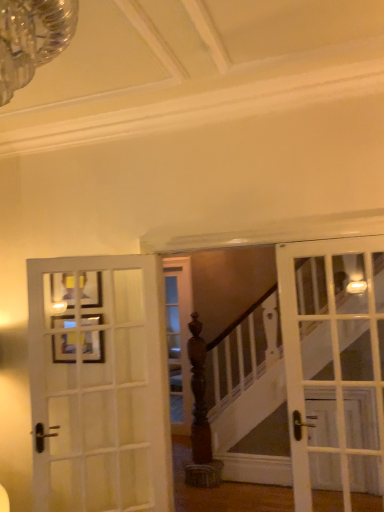
The image size is (384, 512). What do you see at coordinates (334, 359) in the screenshot?
I see `white glass door at right, marked as the first door in a right-to-left arrangement` at bounding box center [334, 359].

Describe the element at coordinates (99, 384) in the screenshot. The height and width of the screenshot is (512, 384). I see `white wood door at left, arranged as the 2th door when viewed from the right` at that location.

What do you see at coordinates (92, 346) in the screenshot? The width and height of the screenshot is (384, 512). I see `wooden picture frame at upper left` at bounding box center [92, 346].

This screenshot has height=512, width=384. I want to click on white glass door at right, marked as the first door in a right-to-left arrangement, so click(x=334, y=359).

Considering the sizes of objects white glass door at right, marked as the first door in a right-to-left arrangement, and white wood door at left, arranged as the 2th door when viewed from the right, in the image provided, who is wider, white glass door at right, marked as the first door in a right-to-left arrangement, or white wood door at left, arranged as the 2th door when viewed from the right,?

white glass door at right, marked as the first door in a right-to-left arrangement.

Is white glass door at right, the 2th door when ordered from left to right, bigger or smaller than white wood door at left, arranged as the 1th door when viewed from the left?

In the image, white glass door at right, the 2th door when ordered from left to right, appears to be smaller than white wood door at left, arranged as the 1th door when viewed from the left.

Are white glass door at right, the 2th door when ordered from left to right, and white wood door at left, arranged as the 1th door when viewed from the left, beside each other?

white glass door at right, the 2th door when ordered from left to right, and white wood door at left, arranged as the 1th door when viewed from the left, are clearly separated.

Where is `door in front of the white wood door at left, arranged as the 2th door when viewed from the right`? door in front of the white wood door at left, arranged as the 2th door when viewed from the right is located at coordinates (334, 359).

Visually, is white wood door at left, arranged as the 1th door when viewed from the left, positioned to the left or to the right of white glass door at right, marked as the first door in a right-to-left arrangement?

From the image, it's evident that white wood door at left, arranged as the 1th door when viewed from the left, is to the left of white glass door at right, marked as the first door in a right-to-left arrangement.

Would you consider white wood door at left, arranged as the 1th door when viewed from the left, to be distant from white glass door at right, the 2th door when ordered from left to right?

Yes.

Between white wood door at left, arranged as the 2th door when viewed from the right, and white glass door at right, the 2th door when ordered from left to right, which one has smaller size?

Smaller between the two is white glass door at right, the 2th door when ordered from left to right.

From the picture: Considering the sizes of white wood door at left, arranged as the 2th door when viewed from the right, and wooden picture frame at upper left in the image, is white wood door at left, arranged as the 2th door when viewed from the right, wider or thinner than wooden picture frame at upper left?

white wood door at left, arranged as the 2th door when viewed from the right, is wider than wooden picture frame at upper left.

From the picture: From a real-world perspective, is white wood door at left, arranged as the 1th door when viewed from the left, under wooden picture frame at upper left?

Yes.

Is wooden picture frame at upper left located within white wood door at left, arranged as the 1th door when viewed from the left?

No, wooden picture frame at upper left is not inside white wood door at left, arranged as the 1th door when viewed from the left.

How different are the orientations of white wood door at left, arranged as the 2th door when viewed from the right, and wooden picture frame at upper left in degrees?

The facing directions of white wood door at left, arranged as the 2th door when viewed from the right, and wooden picture frame at upper left are 31.5 degrees apart.

Are wooden picture frame at upper left and white glass door at right, the 2th door when ordered from left to right, beside each other?

They are not placed beside each other.

Is wooden picture frame at upper left thinner than white glass door at right, marked as the first door in a right-to-left arrangement?

Yes, wooden picture frame at upper left is thinner than white glass door at right, marked as the first door in a right-to-left arrangement.

Between wooden picture frame at upper left and white glass door at right, marked as the first door in a right-to-left arrangement, which one has more height?

Standing taller between the two is white glass door at right, marked as the first door in a right-to-left arrangement.

From the picture: From a real-world perspective, is wooden picture frame at upper left located higher than white wood door at left, arranged as the 1th door when viewed from the left?

Yes, from a real-world perspective, wooden picture frame at upper left is above white wood door at left, arranged as the 1th door when viewed from the left.

Would you say wooden picture frame at upper left is a long distance from white wood door at left, arranged as the 1th door when viewed from the left?

wooden picture frame at upper left is near white wood door at left, arranged as the 1th door when viewed from the left, not far away.

Considering the points (74, 325) and (70, 444), which point is behind, point (74, 325) or point (70, 444)?

Positioned behind is point (70, 444).

How far apart are white glass door at right, the 2th door when ordered from left to right, and wooden picture frame at upper left?

white glass door at right, the 2th door when ordered from left to right, and wooden picture frame at upper left are 6.88 feet apart from each other.

Based on their sizes in the image, would you say white glass door at right, marked as the first door in a right-to-left arrangement, is bigger or smaller than wooden picture frame at upper left?

Considering their sizes, white glass door at right, marked as the first door in a right-to-left arrangement, takes up more space than wooden picture frame at upper left.

Is white glass door at right, marked as the first door in a right-to-left arrangement, wider than wooden picture frame at upper left?

Indeed, white glass door at right, marked as the first door in a right-to-left arrangement, has a greater width compared to wooden picture frame at upper left.

Choose the correct answer: Is white glass door at right, the 2th door when ordered from left to right, inside wooden picture frame at upper left or outside it?

The correct answer is: outside.

Identify the location of door on the right side of white wood door at left, arranged as the 2th door when viewed from the right. (334, 359).

The image size is (384, 512). Find the location of `door located below the white glass door at right, the 2th door when ordered from left to right (from the image's perspective)`. door located below the white glass door at right, the 2th door when ordered from left to right (from the image's perspective) is located at coordinates (99, 384).

Considering their positions, is white glass door at right, the 2th door when ordered from left to right, positioned further to white wood door at left, arranged as the 1th door when viewed from the left, than wooden picture frame at upper left?

Based on the image, white glass door at right, the 2th door when ordered from left to right, appears to be further to white wood door at left, arranged as the 1th door when viewed from the left.

From the image, which object appears to be farther from white glass door at right, the 2th door when ordered from left to right, wooden picture frame at upper left or white wood door at left, arranged as the 1th door when viewed from the left?

wooden picture frame at upper left lies further to white glass door at right, the 2th door when ordered from left to right, than the other object.

When comparing their distances from wooden picture frame at upper left, does white wood door at left, arranged as the 1th door when viewed from the left, or white glass door at right, marked as the first door in a right-to-left arrangement, seem closer?

white wood door at left, arranged as the 1th door when viewed from the left.

When comparing their distances from wooden picture frame at upper left, does white glass door at right, marked as the first door in a right-to-left arrangement, or white wood door at left, arranged as the 1th door when viewed from the left, seem closer?

white wood door at left, arranged as the 1th door when viewed from the left, is closer to wooden picture frame at upper left.

Estimate the real-world distances between objects in this image. Which object is closer to white glass door at right, the 2th door when ordered from left to right, white wood door at left, arranged as the 2th door when viewed from the right, or wooden picture frame at upper left?

white wood door at left, arranged as the 2th door when viewed from the right, lies closer to white glass door at right, the 2th door when ordered from left to right, than the other object.

When comparing their distances from white wood door at left, arranged as the 1th door when viewed from the left, does wooden picture frame at upper left or white glass door at right, the 2th door when ordered from left to right, seem closer?

wooden picture frame at upper left lies closer to white wood door at left, arranged as the 1th door when viewed from the left, than the other object.

You are a GUI agent. You are given a task and a screenshot of the screen. Output one action in this format:
    pyautogui.click(x=<x>, y=<y>)
    Task: Click on the door between wooden picture frame at upper left and white glass door at right, the 2th door when ordered from left to right, from left to right
    The height and width of the screenshot is (512, 384).
    Given the screenshot: What is the action you would take?
    pyautogui.click(x=99, y=384)